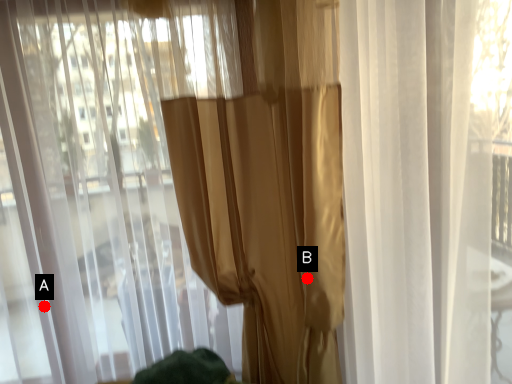
Question: Two points are circled on the image, labeled by A and B beside each circle. Among these points, which one is farthest from the camera?

Choices:
 (A) A is further
 (B) B is further

Answer: (A)